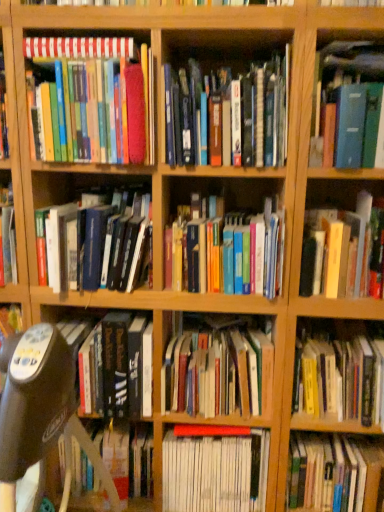
Question: From a real-world perspective, is black plastic swivel chair at center-left over blue hardcover book at upper right, placed as the tenth book when sorted from bottom to top?

Choices:
 (A) yes
 (B) no

Answer: (B)

Question: Is black plastic swivel chair at center-left located outside blue hardcover book at upper right, placed as the tenth book when sorted from bottom to top?

Choices:
 (A) no
 (B) yes

Answer: (B)

Question: Is black plastic swivel chair at center-left with blue hardcover book at upper right, which is the 3th book in top-to-bottom order?

Choices:
 (A) yes
 (B) no

Answer: (B)

Question: Considering the relative positions of black plastic swivel chair at center-left and blue hardcover book at upper right, which is the 3th book in top-to-bottom order, in the image provided, is black plastic swivel chair at center-left to the left of blue hardcover book at upper right, which is the 3th book in top-to-bottom order, from the viewer's perspective?

Choices:
 (A) no
 (B) yes

Answer: (B)

Question: Is black plastic swivel chair at center-left positioned in front of blue hardcover book at upper right, placed as the tenth book when sorted from bottom to top?

Choices:
 (A) yes
 (B) no

Answer: (A)

Question: Are black plastic swivel chair at center-left and blue hardcover book at upper right, which is the 3th book in top-to-bottom order, far apart?

Choices:
 (A) yes
 (B) no

Answer: (B)

Question: Does hardcover books at center, the 8th book viewed from the top, appear on the left side of hardcover books at center, which is counted as the 5th book, starting from the top?

Choices:
 (A) yes
 (B) no

Answer: (A)

Question: Is hardcover books at center, positioned as the 5th book in bottom-to-top order, positioned behind hardcover books at center, the eighth book from the bottom?

Choices:
 (A) yes
 (B) no

Answer: (A)

Question: From the image's perspective, is hardcover books at center, the 8th book viewed from the top, located above hardcover books at center, the eighth book from the bottom?

Choices:
 (A) yes
 (B) no

Answer: (B)

Question: Is hardcover books at center, positioned as the 5th book in bottom-to-top order, positioned with its back to hardcover books at center, which is counted as the 5th book, starting from the top?

Choices:
 (A) yes
 (B) no

Answer: (B)

Question: From a real-world perspective, is hardcover books at center, the 8th book viewed from the top, physically below hardcover books at center, the eighth book from the bottom?

Choices:
 (A) yes
 (B) no

Answer: (A)

Question: Is hardcover books at center, the 8th book viewed from the top, thinner than hardcover books at center, which is counted as the 5th book, starting from the top?

Choices:
 (A) no
 (B) yes

Answer: (B)

Question: Does yellow hardcover book at lower right, the ninth book from the top, come in front of hardcover book at center, which is the eleventh book in top-to-bottom order?

Choices:
 (A) yes
 (B) no

Answer: (A)